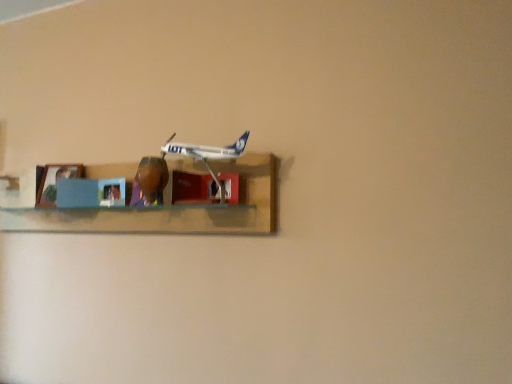
Locate an element on the screen. Image resolution: width=512 pixels, height=384 pixels. white plastic airplane at center is located at coordinates (207, 153).

Where is `white plastic airplane at center`? Image resolution: width=512 pixels, height=384 pixels. white plastic airplane at center is located at coordinates (207, 153).

Would you consider wooden shelf at center to be distant from white plastic airplane at center?

Actually, wooden shelf at center and white plastic airplane at center are a little close together.

Is wooden shelf at center thinner than white plastic airplane at center?

No.

In the scene shown: Is wooden shelf at center outside of white plastic airplane at center?

Yes, wooden shelf at center is outside of white plastic airplane at center.

Between wooden shelf at center and white plastic airplane at center, which one appears on the left side from the viewer's perspective?

Positioned to the left is wooden shelf at center.

Is white plastic airplane at center inside the boundaries of matte blue picture frame at left, or outside?

white plastic airplane at center is outside matte blue picture frame at left.

From a real-world perspective, is white plastic airplane at center above or below matte blue picture frame at left?

In terms of real-world spatial position, white plastic airplane at center is above matte blue picture frame at left.

Does white plastic airplane at center have a lesser height compared to matte blue picture frame at left?

Correct, white plastic airplane at center is not as tall as matte blue picture frame at left.

Considering the positions of point (165, 148) and point (47, 178), is point (165, 148) closer or farther from the camera than point (47, 178)?

Clearly, point (165, 148) is closer to the camera than point (47, 178).

Who is shorter, matte blue picture frame at left or white plastic airplane at center?

white plastic airplane at center is shorter.

From the picture: Is matte blue picture frame at left bigger or smaller than white plastic airplane at center?

matte blue picture frame at left is smaller than white plastic airplane at center.

Could you tell me if matte blue picture frame at left is facing white plastic airplane at center?

No, matte blue picture frame at left is not aimed at white plastic airplane at center.

Locate an element on the screen. picture frame that appears below the white plastic airplane at center (from the image's perspective) is located at coordinates (55, 182).

Can you confirm if wooden shelf at center is shorter than matte blue picture frame at left?

No.

From a real-world perspective, which is physically below, wooden shelf at center or matte blue picture frame at left?

From a 3D spatial view, wooden shelf at center is below.

Considering the positions of point (240, 219) and point (50, 183), is point (240, 219) closer or farther from the camera than point (50, 183)?

Clearly, point (240, 219) is closer to the camera than point (50, 183).

Is wooden shelf at center to the right of matte blue picture frame at left from the viewer's perspective?

Correct, you'll find wooden shelf at center to the right of matte blue picture frame at left.

Is matte blue picture frame at left positioned far away from wooden shelf at center?

No, matte blue picture frame at left is not far from wooden shelf at center.

Locate an element on the screen. The image size is (512, 384). shelf in front of the matte blue picture frame at left is located at coordinates (170, 210).

Is point (40, 190) in front of point (178, 161)?

No, (40, 190) is behind (178, 161).

Measure the distance between matte blue picture frame at left and wooden shelf at center.

A distance of 10.87 inches exists between matte blue picture frame at left and wooden shelf at center.

Is white plastic airplane at center in front of or behind wooden shelf at center in the image?

In the image, white plastic airplane at center appears in front of wooden shelf at center.

Can you confirm if white plastic airplane at center is positioned to the right of wooden shelf at center?

Yes.

Would you say white plastic airplane at center is inside or outside wooden shelf at center?

white plastic airplane at center exists entirely within wooden shelf at center.

From the image's perspective, which object appears higher, white plastic airplane at center or wooden shelf at center?

white plastic airplane at center.

Locate an element on the screen. The height and width of the screenshot is (384, 512). airplane in front of the wooden shelf at center is located at coordinates (207, 153).

I want to click on picture frame lying behind the white plastic airplane at center, so click(55, 182).

When comparing their distances from wooden shelf at center, does white plastic airplane at center or matte blue picture frame at left seem closer?

white plastic airplane at center.

Which object lies nearer to the anchor point white plastic airplane at center, matte blue picture frame at left or wooden shelf at center?

The object closer to white plastic airplane at center is wooden shelf at center.

Based on their spatial positions, is wooden shelf at center or matte blue picture frame at left closer to white plastic airplane at center?

Among the two, wooden shelf at center is located nearer to white plastic airplane at center.

Which object lies further to the anchor point matte blue picture frame at left, wooden shelf at center or white plastic airplane at center?

white plastic airplane at center is further to matte blue picture frame at left.

Estimate the real-world distances between objects in this image. Which object is closer to wooden shelf at center, matte blue picture frame at left or white plastic airplane at center?

Based on the image, white plastic airplane at center appears to be nearer to wooden shelf at center.

From the picture: Considering their positions, is white plastic airplane at center positioned closer to matte blue picture frame at left than wooden shelf at center?

Based on the image, wooden shelf at center appears to be nearer to matte blue picture frame at left.

The width and height of the screenshot is (512, 384). Find the location of `shelf between matte blue picture frame at left and white plastic airplane at center from left to right`. shelf between matte blue picture frame at left and white plastic airplane at center from left to right is located at coordinates (170, 210).